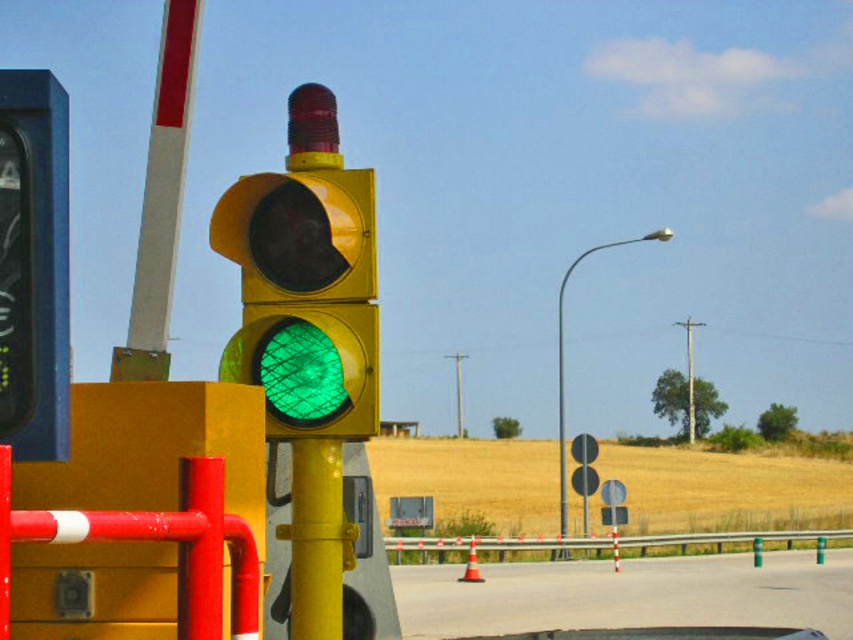
Question: Which object is the closest to the yellow matte/glass traffic light at center?

Choices:
 (A) metallic yellow barrier at center
 (B) smooth metal barricade at left

Answer: (B)

Question: Which of the following is the closest to the observer?

Choices:
 (A) metallic yellow barrier at center
 (B) smooth asphalt highway at center
 (C) yellow matte/glass traffic light at center
 (D) smooth metal barricade at left

Answer: (D)

Question: In this image, where is smooth metal barricade at left located relative to metallic yellow barrier at center?

Choices:
 (A) above
 (B) below

Answer: (A)

Question: Is smooth asphalt highway at center further to camera compared to smooth metal barricade at left?

Choices:
 (A) no
 (B) yes

Answer: (B)

Question: Which point is farther to the camera?

Choices:
 (A) (259, 596)
 (B) (329, 352)

Answer: (B)

Question: Is smooth asphalt highway at center to the left of smooth metal barricade at left from the viewer's perspective?

Choices:
 (A) no
 (B) yes

Answer: (A)